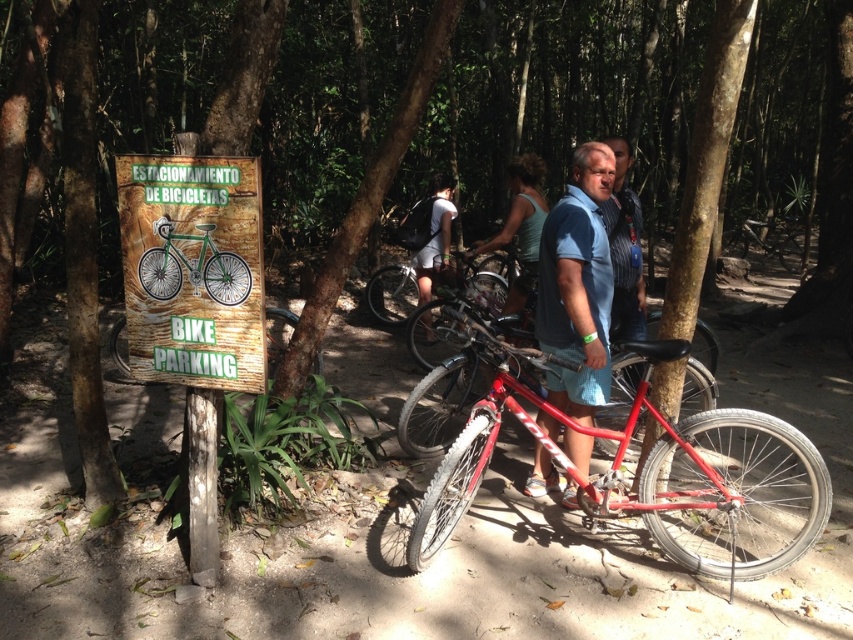
Is green matte bicycle at left in front of matte green tank top at center?

Yes, green matte bicycle at left is closer to the viewer.

Consider the image. Measure the distance between point (167, 294) and camera.

Point (167, 294) is 10.48 feet from camera.

Which is in front, point (152, 252) or point (508, 227)?

Point (152, 252) is in front.

Where is `green matte bicycle at left`? green matte bicycle at left is located at coordinates (193, 266).

Is metallic blue shirt at center to the right of red matte bicycle at center from the viewer's perspective?

Yes, metallic blue shirt at center is to the right of red matte bicycle at center.

Who is positioned more to the left, metallic blue shirt at center or red matte bicycle at center?

From the viewer's perspective, red matte bicycle at center appears more on the left side.

This screenshot has height=640, width=853. Find the location of `metallic blue shirt at center`. metallic blue shirt at center is located at coordinates (579, 280).

Can you confirm if shiny red bicycle at center is bigger than matte green tank top at center?

Correct, shiny red bicycle at center is larger in size than matte green tank top at center.

Is point (723, 492) positioned behind point (517, 177)?

No, (723, 492) is in front of (517, 177).

Which is behind, point (659, 547) or point (520, 284)?

The point (520, 284) is more distant.

Find the location of a particular element. Image resolution: width=853 pixels, height=640 pixels. shiny red bicycle at center is located at coordinates (642, 467).